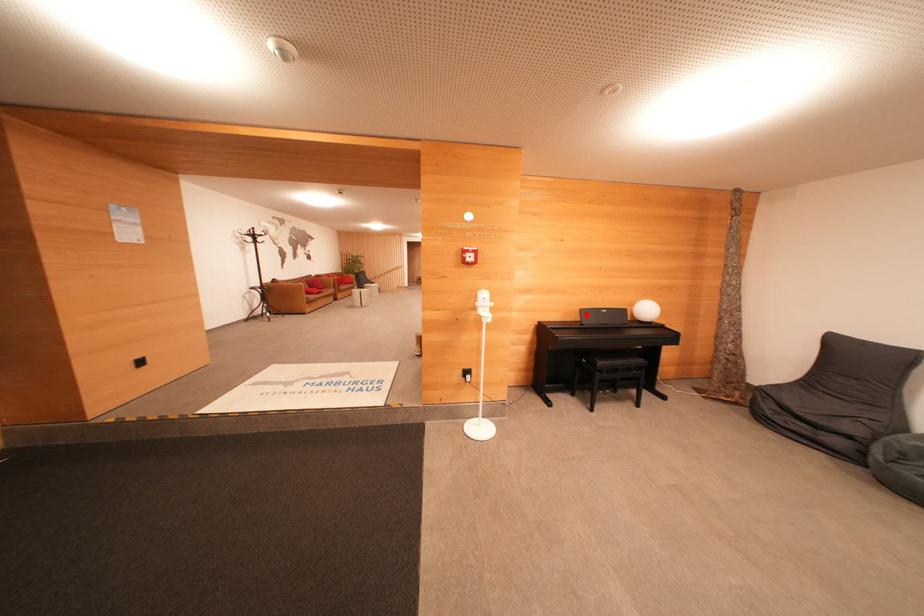
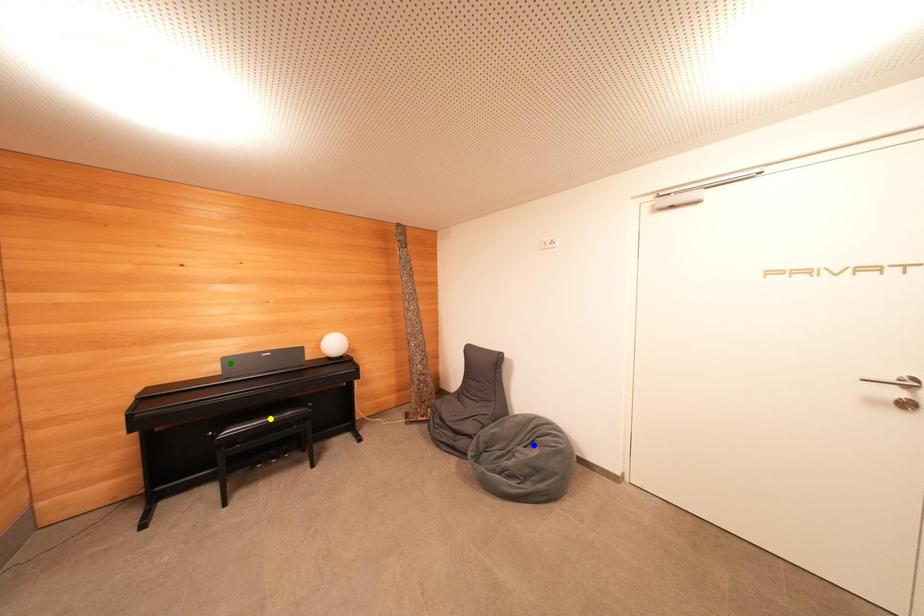
Question: I am providing you with two images of the same scene from different viewpoints. A red point is marked on the first image. You are given multiple points on the second image. Which point in image 2 represents the same 3d spot as the red point in image 1?

Choices:
 (A) yellow point
 (B) blue point
 (C) green point

Answer: (C)